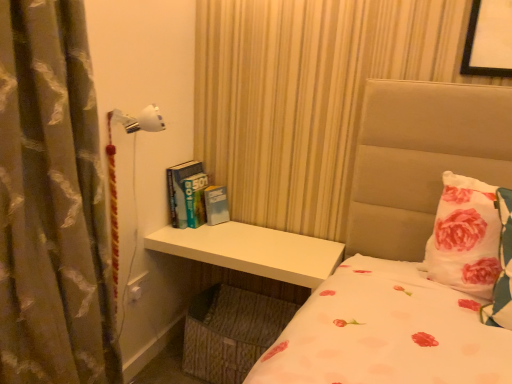
The image size is (512, 384). What are the coordinates of `free spot in front of hardcover books at center` in the screenshot? It's located at tap(188, 241).